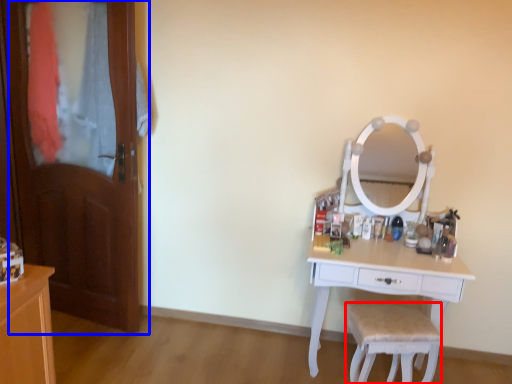
Question: Which object appears farthest to the camera in this image, chair (highlighted by a red box) or door (highlighted by a blue box)?

Choices:
 (A) chair
 (B) door

Answer: (B)